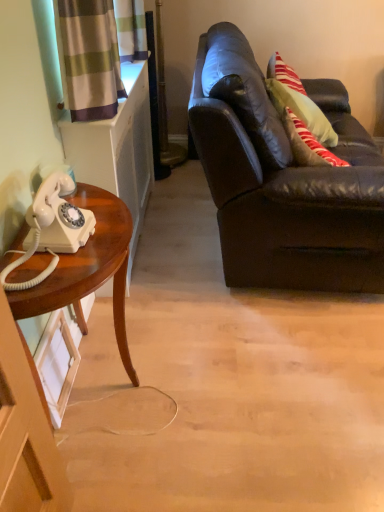
Find the location of a particular element. The height and width of the screenshot is (512, 384). vacant space to the right of wooden desk at left is located at coordinates (205, 387).